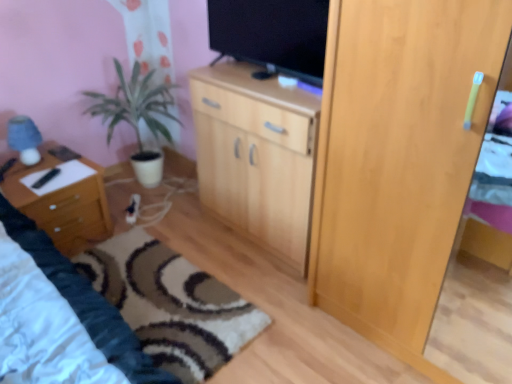
Where is `free space above carpet with swirl pattern at lower center (from a real-world perspective)`? Image resolution: width=512 pixels, height=384 pixels. free space above carpet with swirl pattern at lower center (from a real-world perspective) is located at coordinates (157, 297).